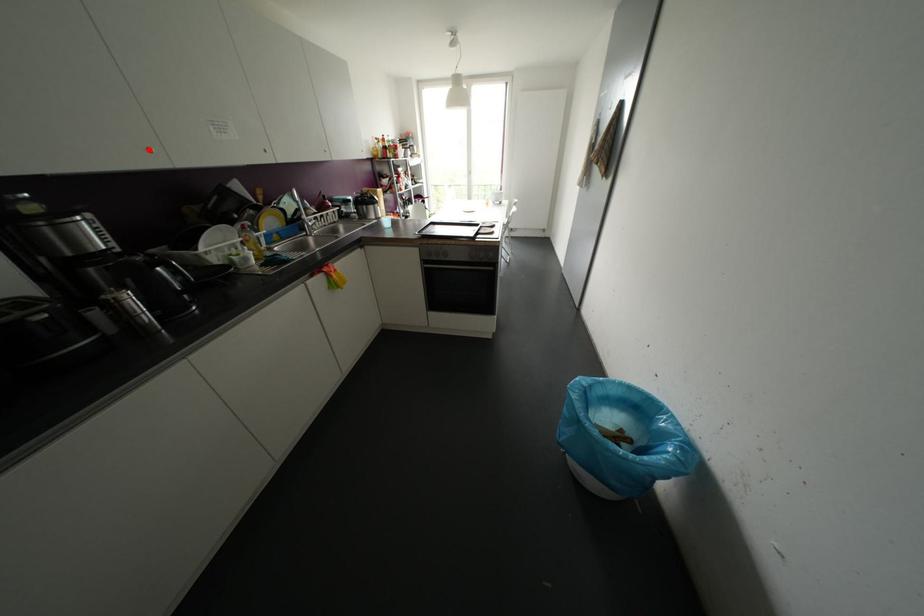
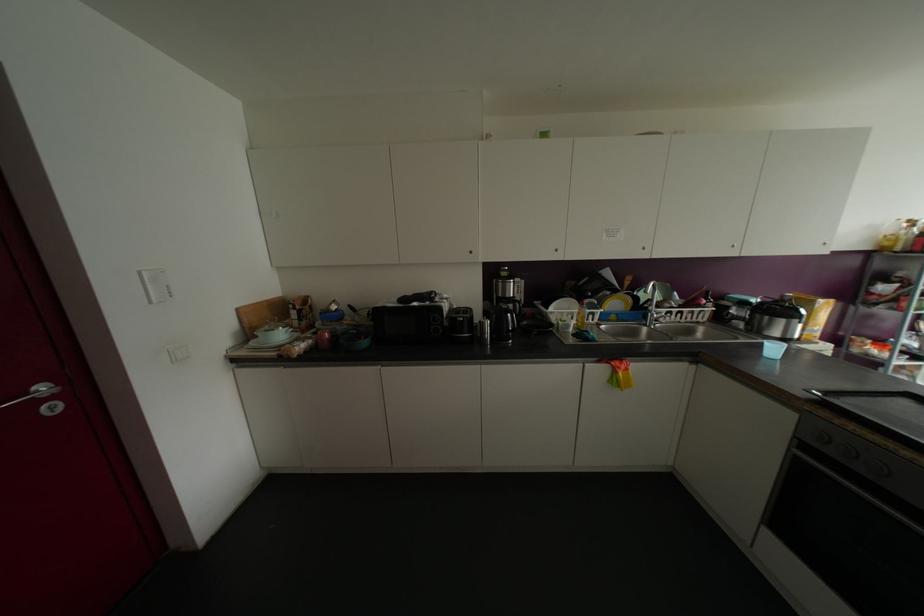
Find the pixel in the second image that matches the highlighted location in the first image.

(555, 249)